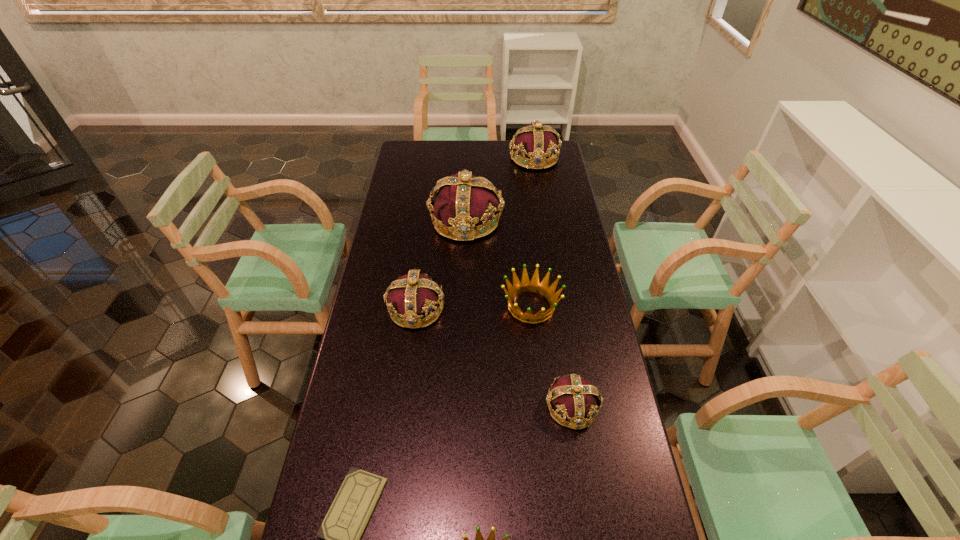
This screenshot has width=960, height=540. I want to click on the tallest object, so click(x=463, y=201).

This screenshot has width=960, height=540. Identify the location of the second farthest crown. coord(463,201).

At what (x,y) coordinates should I click in order to perform the action: click on the second tallest object. Please return your answer as a coordinate pair (x, y). This screenshot has height=540, width=960. Looking at the image, I should click on (535, 142).

The height and width of the screenshot is (540, 960). I want to click on the third smallest purple crown, so pyautogui.click(x=535, y=142).

Where is `the third farthest purple crown`? The height and width of the screenshot is (540, 960). the third farthest purple crown is located at coordinates (414, 295).

Where is `the fifth shortest object`? the fifth shortest object is located at coordinates (414, 295).

You are a GUI agent. You are given a task and a screenshot of the screen. Output one action in this format:
    pyautogui.click(x=<x>, y=<y>)
    Task: Click on the fifth farthest crown
    This screenshot has width=960, height=540.
    Given the screenshot: What is the action you would take?
    pyautogui.click(x=576, y=399)

This screenshot has width=960, height=540. I want to click on the smallest purple crown, so click(576, 399).

Where is `the bigger golden crown`? the bigger golden crown is located at coordinates tap(526, 285).

The height and width of the screenshot is (540, 960). Identify the location of free location located on the front of the third nearest purple crown. (463, 316).